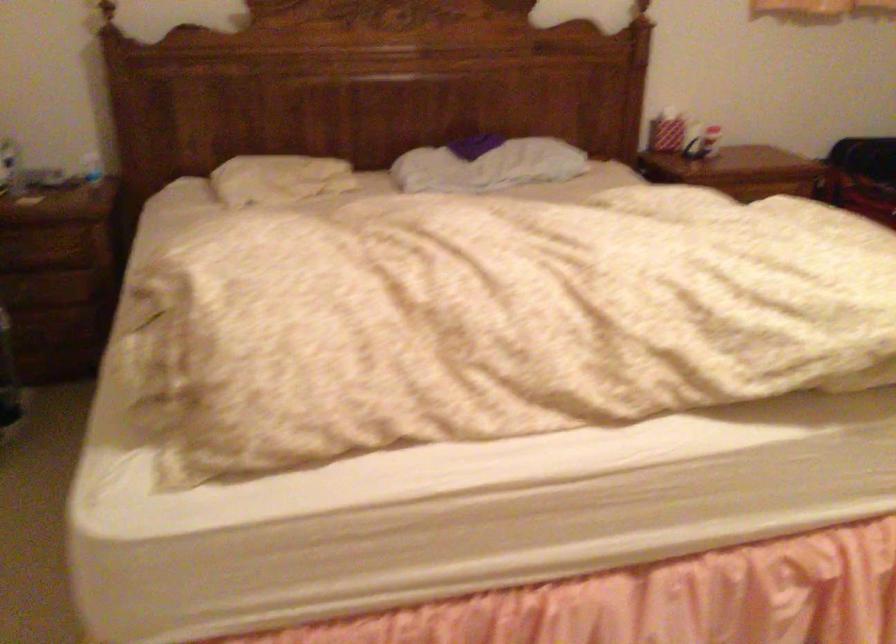
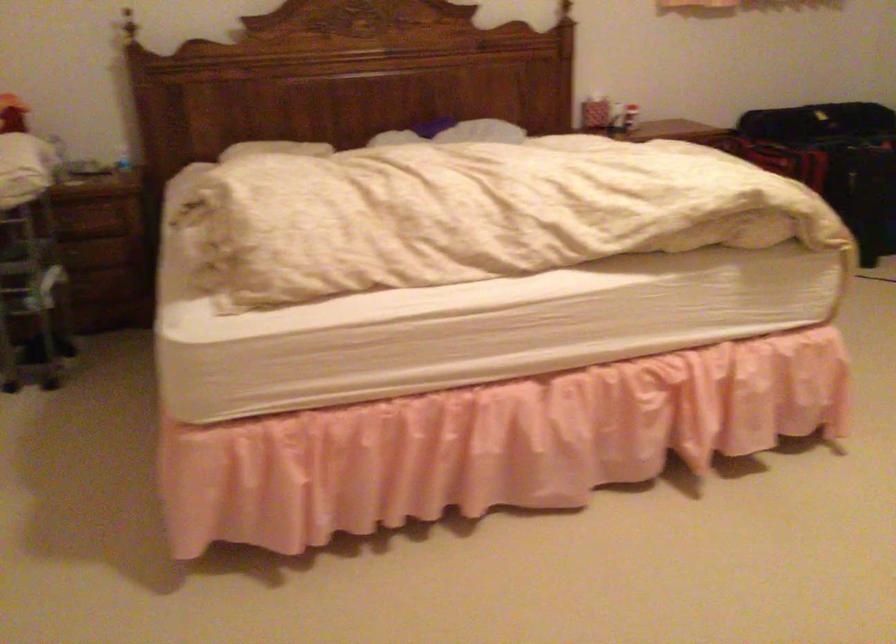
In the second image, find the point that corresponds to pixel 657 146 in the first image.

(590, 109)